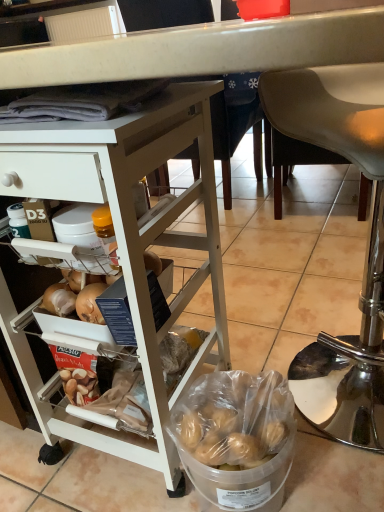
Question: From a real-world perspective, relative to metallic silver chair at lower right, is clear plastic bucket at lower center vertically above or below?

Choices:
 (A) below
 (B) above

Answer: (A)

Question: Relative to metallic silver chair at lower right, is clear plastic bucket at lower center in front or behind?

Choices:
 (A) front
 (B) behind

Answer: (B)

Question: Considering the real-world distances, which object is farthest from the clear plastic bucket at lower center?

Choices:
 (A) metallic silver chair at lower right
 (B) white matte desk at upper left

Answer: (A)

Question: Which is nearer to the white matte desk at upper left?

Choices:
 (A) metallic silver chair at lower right
 (B) clear plastic bucket at lower center

Answer: (B)